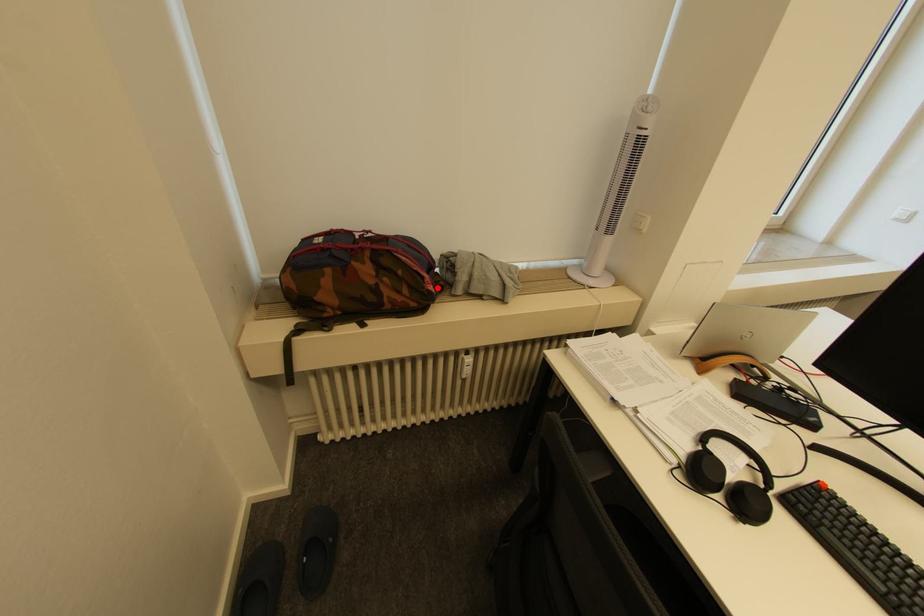
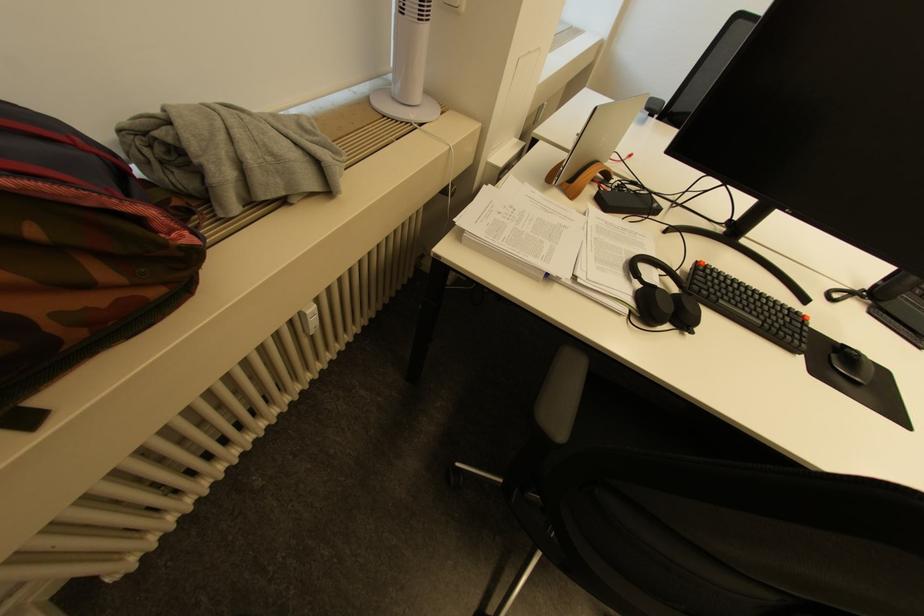
In the second image, find the point that corresponds to the highlighted location in the first image.

(196, 238)